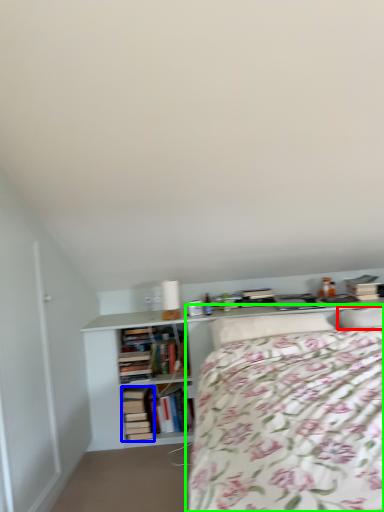
Question: Which object is the farthest from pillow (highlighted by a red box)? Choose among these: book (highlighted by a blue box) or bed (highlighted by a green box).

Choices:
 (A) book
 (B) bed

Answer: (A)